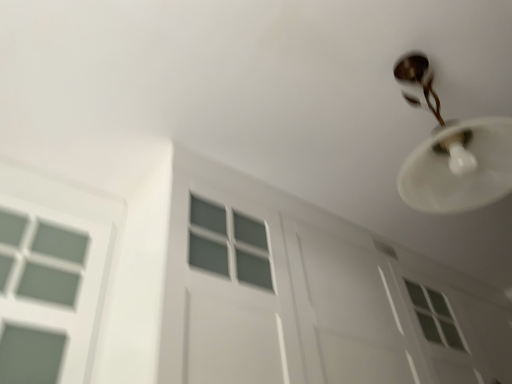
In the scene shown: Measure the distance between point (357, 294) and camera.

The depth of point (357, 294) is 5.13 feet.

Describe the element at coordinates (311, 296) in the screenshot. The image size is (512, 384). I see `white painted wood garage door at center` at that location.

This screenshot has width=512, height=384. In order to click on white painted wood garage door at center in this screenshot , I will do `click(311, 296)`.

At what (x,y) coordinates should I click in order to perform the action: click on white painted wood garage door at center. Please return your answer as a coordinate pair (x, y). This screenshot has height=384, width=512. Looking at the image, I should click on (311, 296).